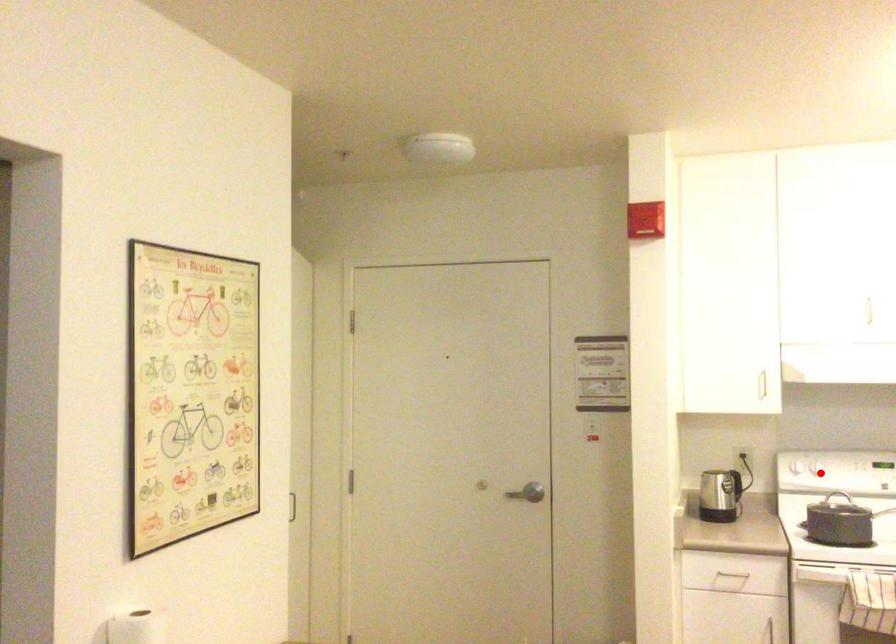
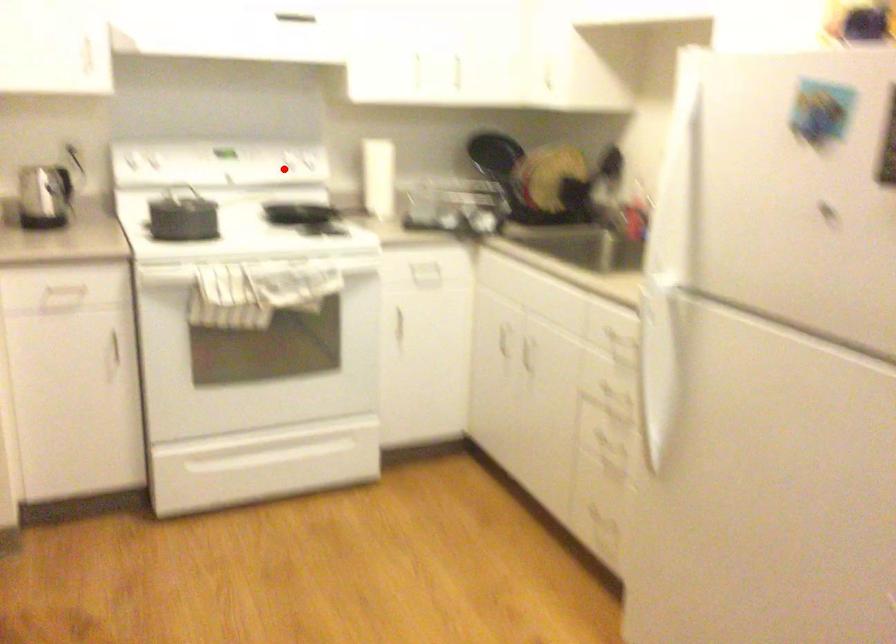
I am providing you with two images of the same scene from different viewpoints. A red point is marked on the first image and another point is marked on the second image. Is the marked point in image1 the same physical position as the marked point in image2?

No